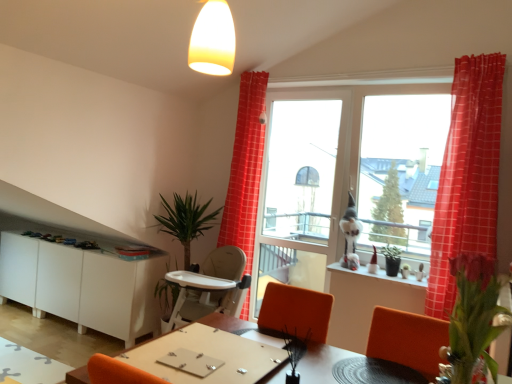
Question: Should I look upward or downward to see white matte cabinet at lower left?

Choices:
 (A) up
 (B) down

Answer: (B)

Question: Does white glossy window sill at lower right have a greater width compared to wooden table at center, marked as the second table in a bottom-to-top arrangement?

Choices:
 (A) yes
 (B) no

Answer: (B)

Question: Is white glossy window sill at lower right not inside wooden table at center, which is the 1th table in front-to-back order?

Choices:
 (A) yes
 (B) no

Answer: (A)

Question: Is white glossy window sill at lower right further to camera compared to wooden table at center, the 1th table when ordered from top to bottom?

Choices:
 (A) no
 (B) yes

Answer: (B)

Question: From the image's perspective, is white glossy window sill at lower right below wooden table at center, which ranks as the second table in back-to-front order?

Choices:
 (A) no
 (B) yes

Answer: (A)

Question: Is white glossy window sill at lower right positioned with its back to wooden table at center, which is the second table from left to right?

Choices:
 (A) no
 (B) yes

Answer: (A)

Question: From a real-world perspective, is white glossy window sill at lower right under wooden table at center, which is the 1th table in front-to-back order?

Choices:
 (A) yes
 (B) no

Answer: (B)

Question: Is wooden table at lower left, which is the 1th table in back-to-front order, further to the viewer compared to pink matte flower at right, which appears as the first plant when viewed from the right?

Choices:
 (A) yes
 (B) no

Answer: (A)

Question: Considering the relative sizes of wooden table at lower left, which is the 1th table in back-to-front order, and pink matte flower at right, placed as the second plant when sorted from left to right, in the image provided, is wooden table at lower left, which is the 1th table in back-to-front order, wider than pink matte flower at right, placed as the second plant when sorted from left to right,?

Choices:
 (A) no
 (B) yes

Answer: (B)

Question: From a real-world perspective, is wooden table at lower left, the 2th table from the front, physically below pink matte flower at right, placed as the second plant when sorted from left to right?

Choices:
 (A) no
 (B) yes

Answer: (B)

Question: Does wooden table at lower left, positioned as the 1th table in bottom-to-top order, have a lesser width compared to pink matte flower at right, which appears as the first plant when viewed from the right?

Choices:
 (A) no
 (B) yes

Answer: (A)

Question: Considering the relative sizes of wooden table at lower left, positioned as the second table in top-to-bottom order, and pink matte flower at right, placed as the second plant when sorted from left to right, in the image provided, is wooden table at lower left, positioned as the second table in top-to-bottom order, smaller than pink matte flower at right, placed as the second plant when sorted from left to right,?

Choices:
 (A) yes
 (B) no

Answer: (B)

Question: From the image's perspective, is wooden table at lower left, which is the 1th table in back-to-front order, below pink matte flower at right, which is counted as the 1th plant, starting from the front?

Choices:
 (A) yes
 (B) no

Answer: (A)

Question: Is green leafy plant at left a part of white matte cabinet at lower left?

Choices:
 (A) no
 (B) yes

Answer: (A)